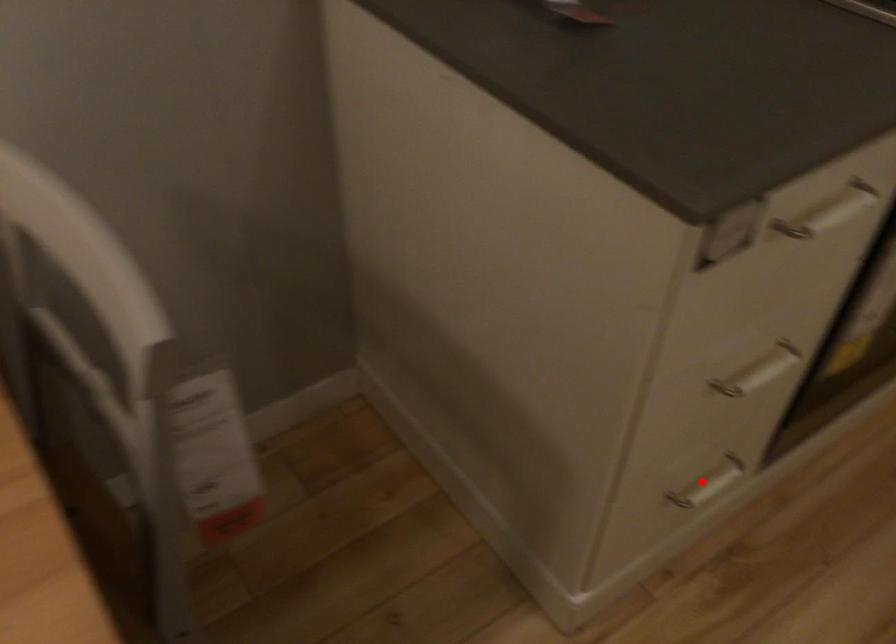
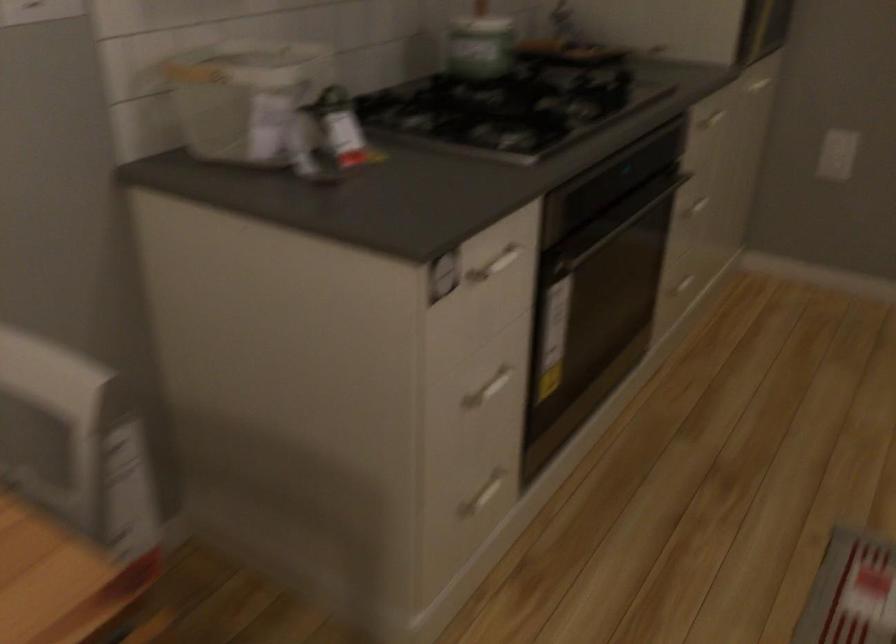
In the second image, find the point that corresponds to the highlighted location in the first image.

(484, 494)